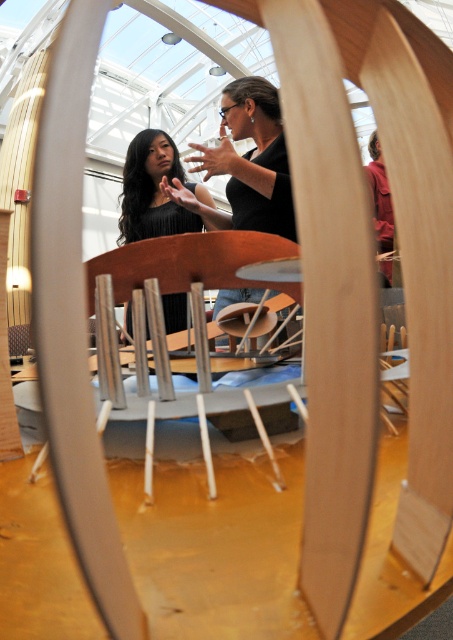
You are standing in the room shown in the image. There is a black matte shirt at center located at point [251,157]. If you want to place a small decorative item exactly at that point, which object should you place it near?

You should place the small decorative item near the black matte shirt at center located at point [251,157].

You are standing in the room and want to see both the black matte shirt at center and the black matte dress at center clearly through the circular wooden frame. Which one is closer to the frame?

The black matte shirt at center is in front of the black matte dress at center, so it is closer to the frame.

You are an interior designer arranging a photoshoot. You have to place a decorative item between the black matte shirt at center and the black matte dress at center in the image. Which direction should you place it to ensure it is between them?

The black matte shirt at center is located below the black matte dress at center, so placing the decorative item between them would require positioning it below the black matte dress at center and above the black matte shirt at center.